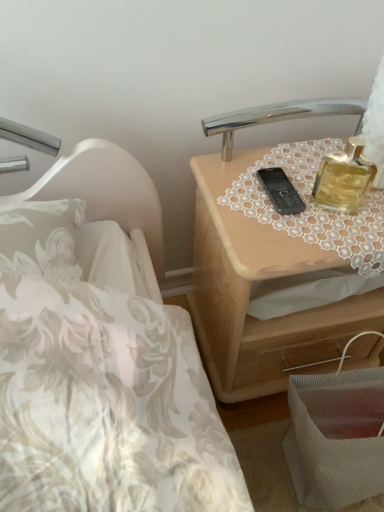
The width and height of the screenshot is (384, 512). In order to click on free spot in front of gold glass perfume at upper right in this screenshot , I will do `click(333, 234)`.